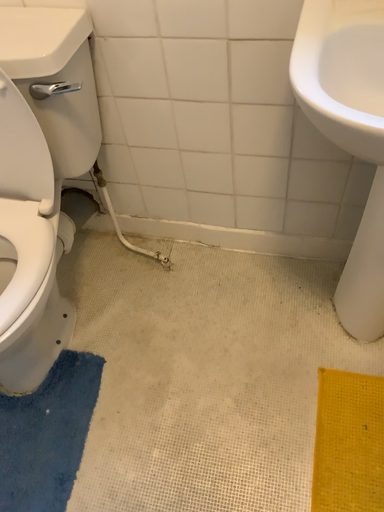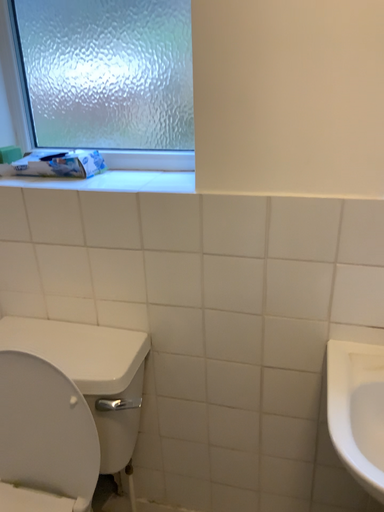
Question: How did the camera likely rotate when shooting the video?

Choices:
 (A) rotated downward
 (B) rotated upward

Answer: (B)